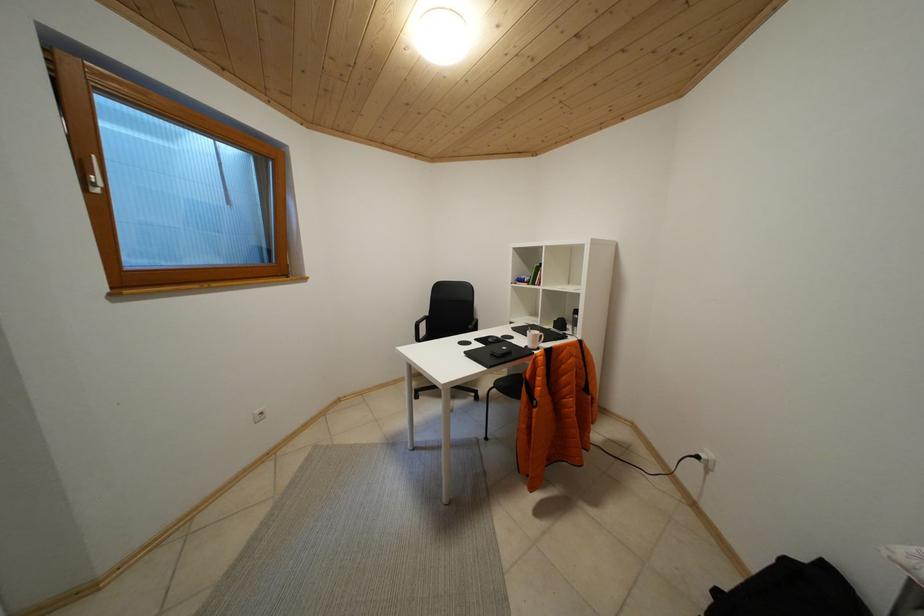
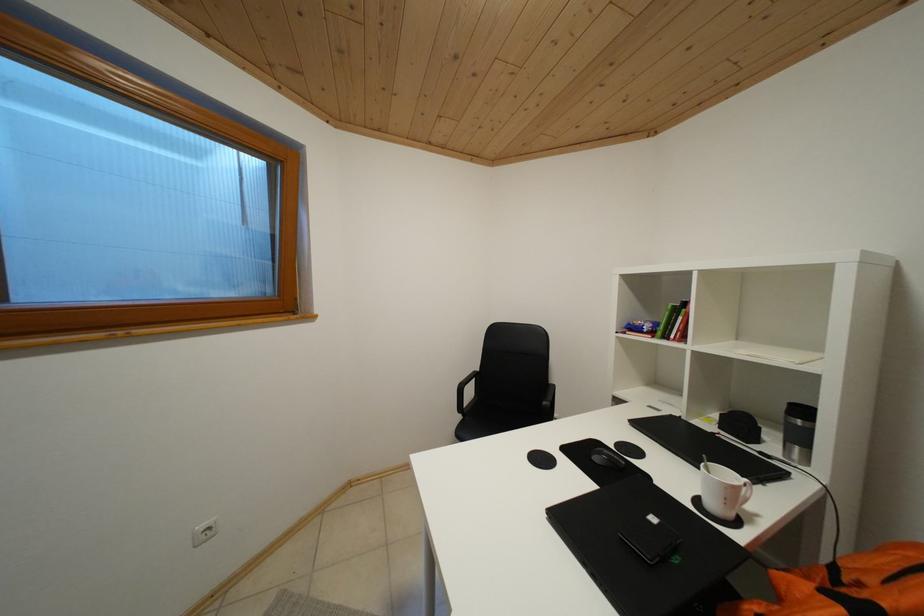
Question: Which direction would the cameraman need to move to produce the second image? Reply with the corresponding letter.

Choices:
 (A) Left
 (B) Right
 (C) Forward
 (D) Backward

Answer: (C)